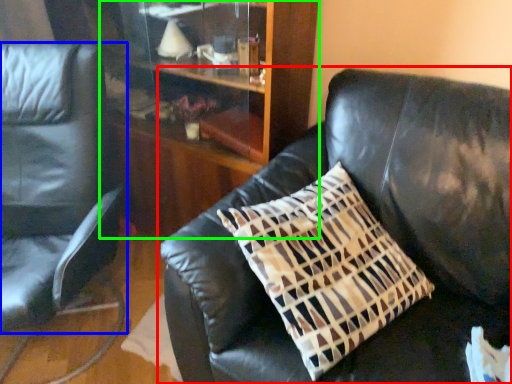
Question: Which is farther away from studio couch (highlighted by a red box)? chair (highlighted by a blue box) or dresser (highlighted by a green box)?

Choices:
 (A) chair
 (B) dresser

Answer: (A)